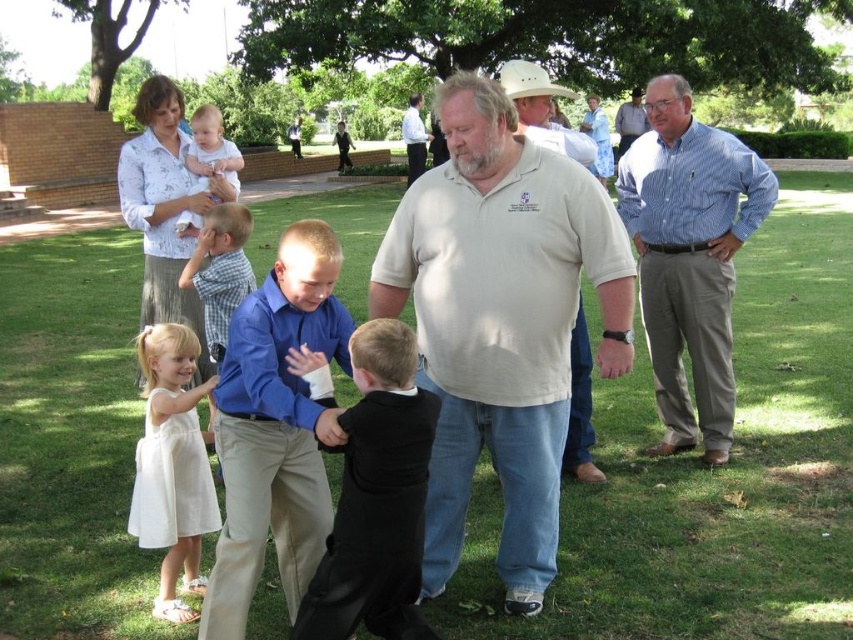
You are a photographer setting up for a group photo. You notice two people wearing the white cotton shirt at center and the blue striped shirt at right. Which one should you position closer to the front to ensure both are in focus?

Since the white cotton shirt at center is not as tall as the blue striped shirt at right, you should position the white cotton shirt at center closer to the front to ensure both are in focus.

You are a photographer positioned at the center of the scene. You need to capture a photo that includes both the white cotton shirt at center and the light beige shirt at center. Given their distance apart, is it possible to frame both in the same shot without moving your position?

The white cotton shirt at center is 18.38 meters from the light beige shirt at center. At 18.38 meters apart, it would be challenging to frame both in the same shot from the center position without zooming out significantly or using a wide angle lens, as typical camera framing might struggle to encompass such a large distance between subjects.